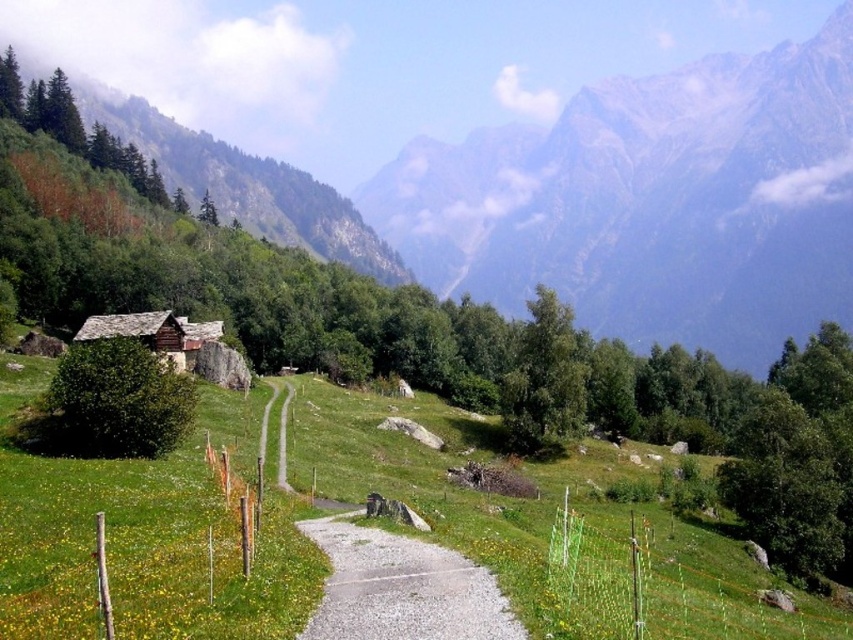
You are a hiker planning to cross the green grassy at lower left and the gravelly dirt path at center. Which path is wider?

The green grassy at lower left is wider than the gravelly dirt path at center according to the description.